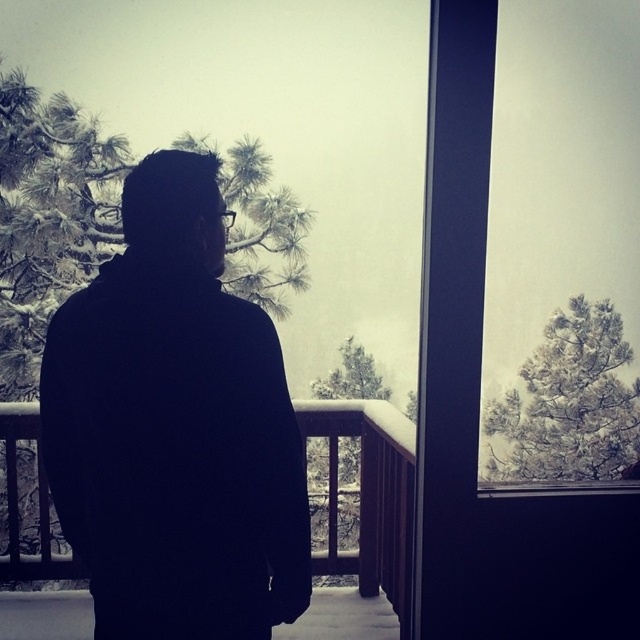
You are standing inside the building looking through the large window. You notice a point at coordinates (176, 428) on the window. What object is located at that point?

The point at coordinates (176, 428) corresponds to the black matte jacket at center.

You are standing inside the building looking out through the window. There is a point marked at coordinates (176, 428). What object is located at that point?

The black matte jacket at center is located at point (176, 428).